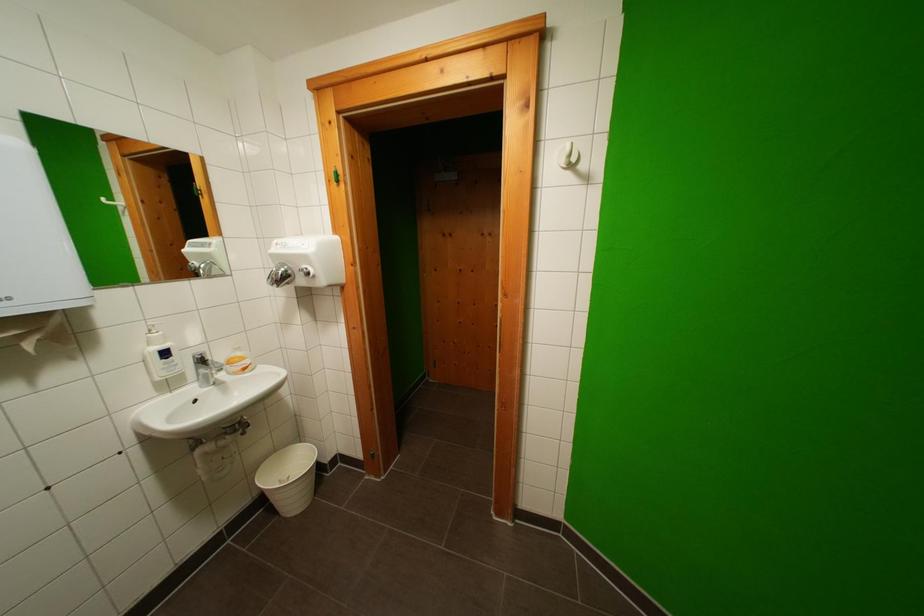
Where would you lift the sink faucet handle? Please return your answer as a coordinate pair (x, y).

(200, 358)